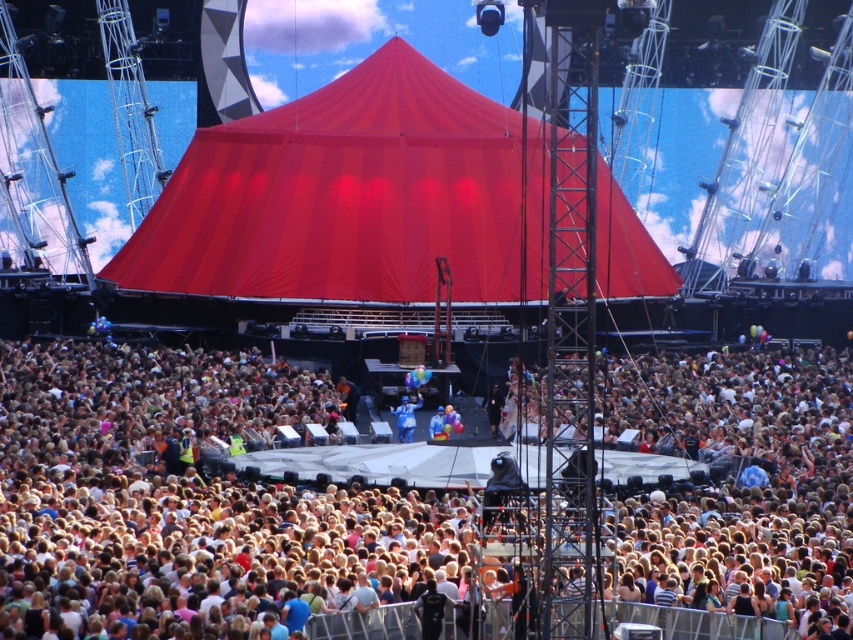
You are standing in the concert area and want to move from the point closer to you to the point further away. Which path should you take between the two points, point (x=436, y=198) and point (x=395, y=408)?

You should move from point (x=436, y=198) to point (x=395, y=408) since point (x=436, y=198) is closer to you and point (x=395, y=408) is further away.

You are standing at the center of the stage in front of the large red tent. You want to move towards the white cotton crowd at center. Is the point at coordinate point (219, 502) on the path towards the white cotton crowd at center?

The point at coordinate point (219, 502) corresponds to the white cotton crowd at center, so yes, it is on the path towards the white cotton crowd at center.